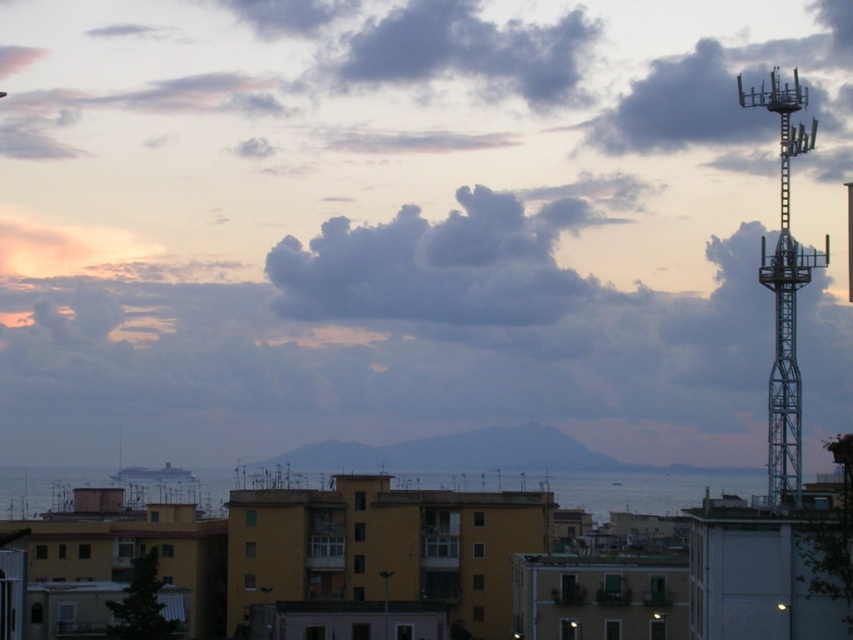
Question: Considering the real-world distances, which object is farthest from the blue metallic cruise ship at lower center?

Choices:
 (A) metallic silver tower at right
 (B) white glossy cruise ship at center

Answer: (A)

Question: Is matte metal tower at upper right wider than blue metallic cruise ship at lower center?

Choices:
 (A) no
 (B) yes

Answer: (B)

Question: Is the position of metallic silver tower at right less distant than that of blue water at center?

Choices:
 (A) no
 (B) yes

Answer: (A)

Question: Is matte metal tower at upper right positioned at the back of white glossy cruise ship at center?

Choices:
 (A) yes
 (B) no

Answer: (A)

Question: Which of the following is the farthest from the observer?

Choices:
 (A) white glossy cruise ship at center
 (B) matte metal tower at upper right
 (C) blue water at center
 (D) blue metallic cruise ship at lower center

Answer: (D)

Question: Which of the following is the farthest from the observer?

Choices:
 (A) matte metal tower at upper right
 (B) white glossy cruise ship at center
 (C) metallic silver tower at right
 (D) blue water at center

Answer: (A)